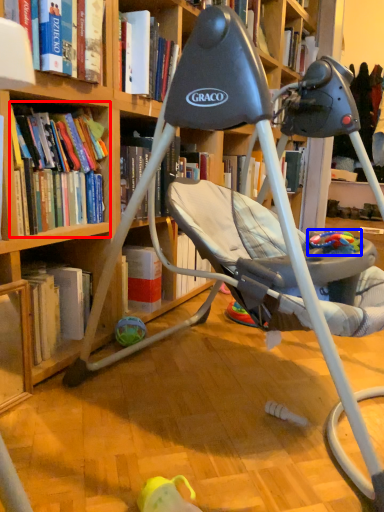
Question: Which point is closer to the camera, book (highlighted by a red box) or toy (highlighted by a blue box)?

Choices:
 (A) book
 (B) toy

Answer: (A)